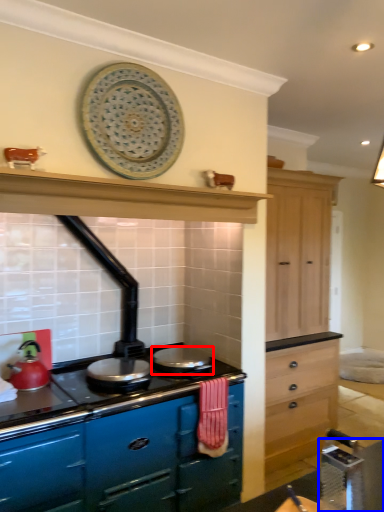
Question: Which object appears farthest to the camera in this image, appliance (highlighted by a red box) or table (highlighted by a blue box)?

Choices:
 (A) appliance
 (B) table

Answer: (A)